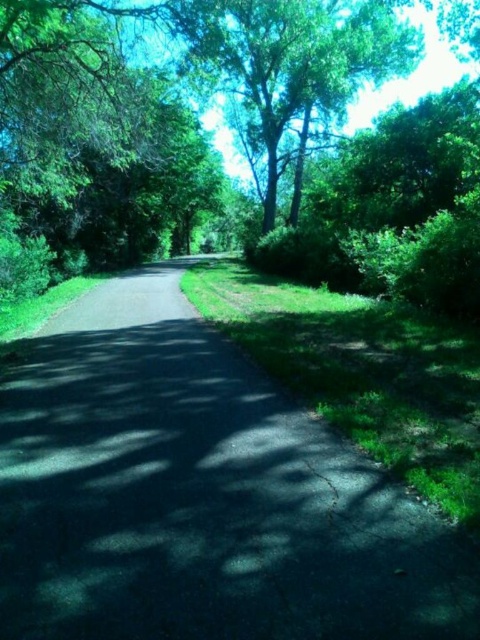
Question: Among these points, which one is farthest from the camera?

Choices:
 (A) (179, 275)
 (B) (279, 129)

Answer: (B)

Question: Is dark asphalt path at center positioned at the back of green leafy tree at upper center?

Choices:
 (A) yes
 (B) no

Answer: (B)

Question: Is dark asphalt path at center in front of green leafy tree at upper center?

Choices:
 (A) yes
 (B) no

Answer: (A)

Question: Does dark asphalt path at center have a larger size compared to green leafy tree at upper center?

Choices:
 (A) no
 (B) yes

Answer: (B)

Question: Which point is farther from the camera taking this photo?

Choices:
 (A) (287, 589)
 (B) (230, 42)

Answer: (B)